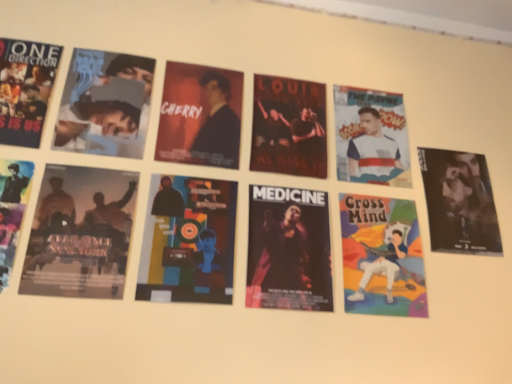
Question: Considering their positions, is matte black jacket at center, the second person in the left-to-right sequence, located in front of or behind silhouette paper poster at lower left, positioned as the second poster in left-to-right order?

Choices:
 (A) behind
 (B) front

Answer: (A)

Question: From a real-world perspective, is matte black jacket at center, acting as the 3th person starting from the right, above or below silhouette paper poster at lower left, positioned as the 5th poster in right-to-left order?

Choices:
 (A) above
 (B) below

Answer: (A)

Question: Which object is positioned closest to the multicolored paper cross my mind poster at center right, the sixth poster positioned from the left?

Choices:
 (A) multicolored paper at center, positioned as the third poster in left-to-right order
 (B) dark matte poster at center, the 2th poster positioned from the right
 (C) silhouette paper poster at lower left, positioned as the 5th poster in right-to-left order
 (D) shiny black jacket at right, the first person when ordered from right to left
 (E) dark matte poster at center, arranged as the third poster when viewed from the right

Answer: (E)

Question: Considering the real-world distances, which object is farthest from the dark matte poster at center, the 2th poster positioned from the right?

Choices:
 (A) matte black poster at left, which is the 6th poster in right-to-left order
 (B) multicolored paper cross my mind poster at center right, the sixth poster positioned from the left
 (C) white fabric shirt at upper right, marked as the 3th person in a left-to-right arrangement
 (D) matte black poster at upper left, placed as the fourth person when sorted from right to left
 (E) matte black jacket at center, the second person in the left-to-right sequence

Answer: (A)